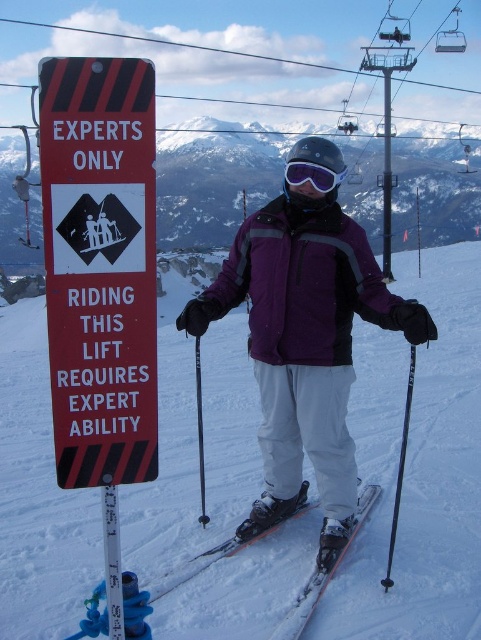
Question: Does purple softshell jacket at center have a smaller size compared to shiny metallic ski at center?

Choices:
 (A) no
 (B) yes

Answer: (A)

Question: Does red plastic sign at left appear over white snow mountain at upper center?

Choices:
 (A) no
 (B) yes

Answer: (A)

Question: Estimate the real-world distances between objects in this image. Which object is closer to the red plastic sign at left?

Choices:
 (A) purple softshell jacket at center
 (B) purple matte ski goggles at center

Answer: (A)

Question: Estimate the real-world distances between objects in this image. Which object is farther from the purple softshell jacket at center?

Choices:
 (A) shiny metallic ski at center
 (B) white snow mountain at upper center

Answer: (B)

Question: Does white snow mountain at upper center appear under shiny metallic skis at center?

Choices:
 (A) no
 (B) yes

Answer: (A)

Question: Which of these objects is positioned closest to the shiny metallic skis at center?

Choices:
 (A) purple softshell jacket at center
 (B) white snow mountain at upper center

Answer: (A)